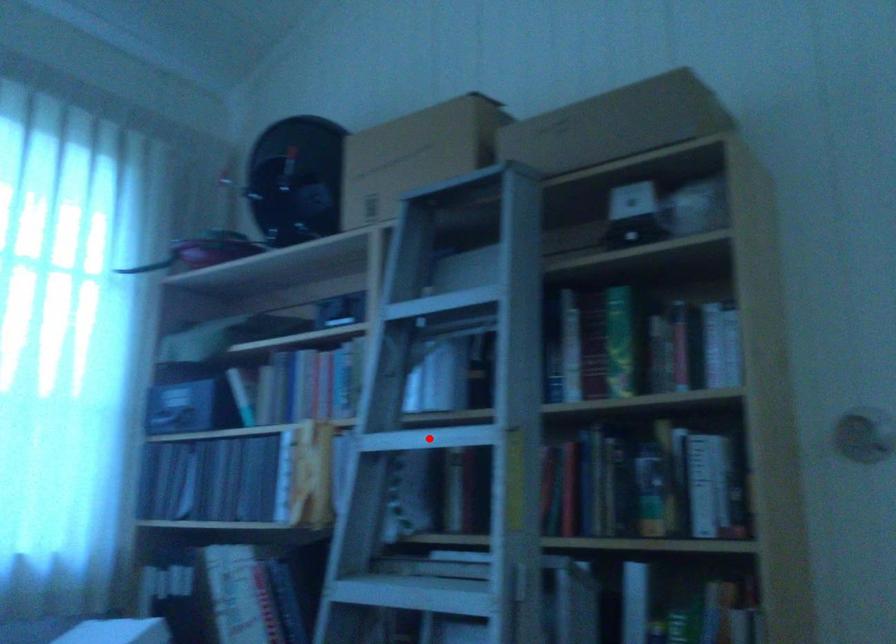
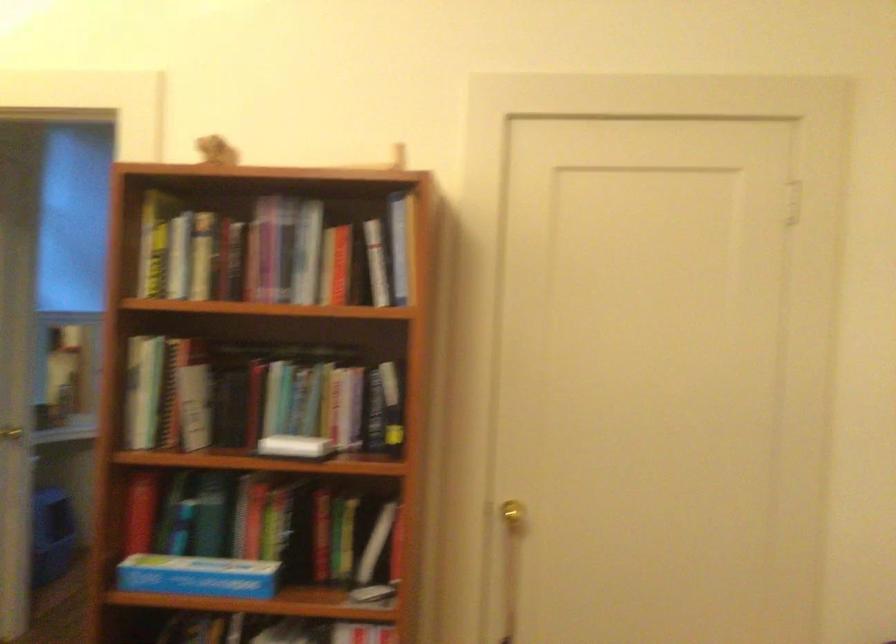
Question: I am providing you with two images of the same scene from different viewpoints. A red point is marked on the first image. Can you still see the location of the red point in image 2?

Choices:
 (A) Yes
 (B) No

Answer: (B)